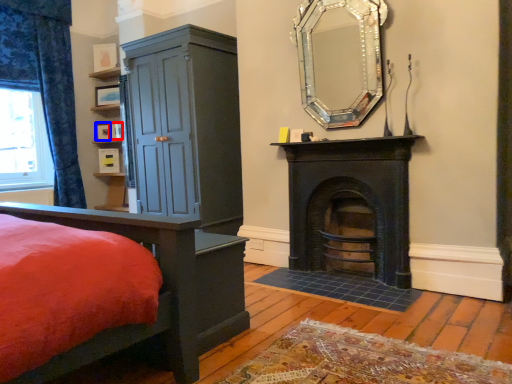
Question: Which object is further to the camera taking this photo, picture frame (highlighted by a red box) or picture frame (highlighted by a blue box)?

Choices:
 (A) picture frame
 (B) picture frame

Answer: (B)